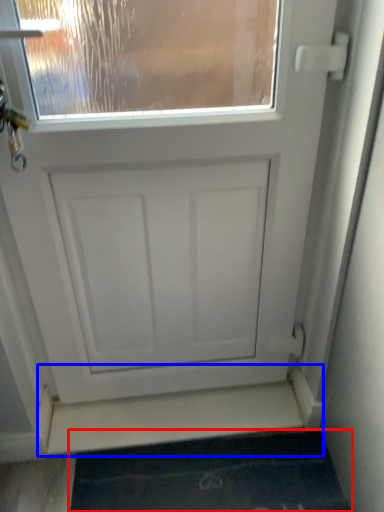
Question: Which object appears farthest to the camera in this image, bath mat (highlighted by a red box) or stairwell (highlighted by a blue box)?

Choices:
 (A) bath mat
 (B) stairwell

Answer: (B)